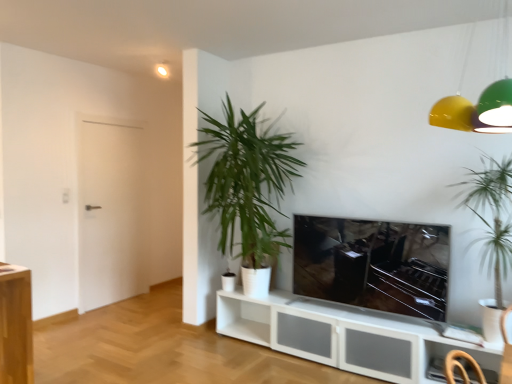
The height and width of the screenshot is (384, 512). Identify the location of vacant area that lies in front of white matte door at left. (113, 314).